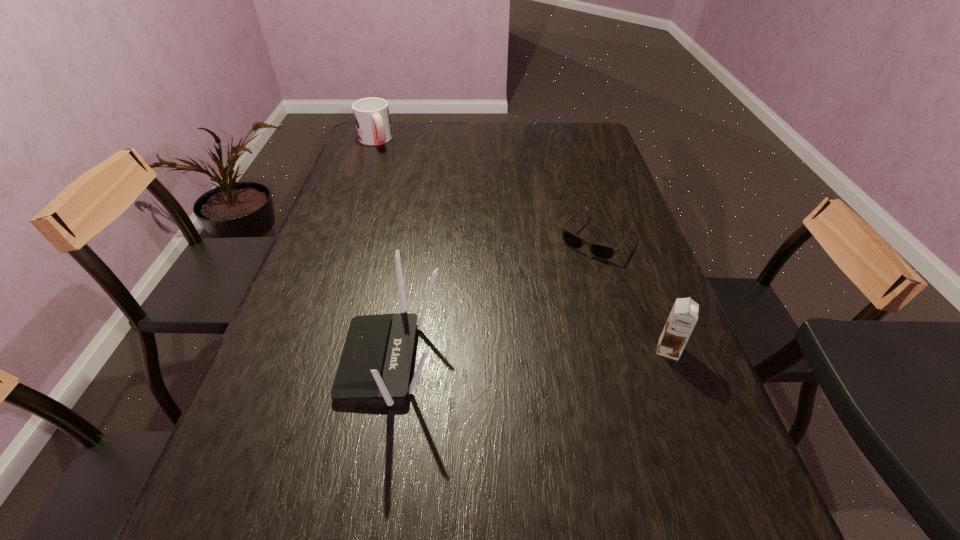
Where is `blank area in the image that satisfies the following two spatial constraints: 1. on the front side of the chocolate milk; 2. on the left side of the sunglasses`? The width and height of the screenshot is (960, 540). blank area in the image that satisfies the following two spatial constraints: 1. on the front side of the chocolate milk; 2. on the left side of the sunglasses is located at coordinates (630, 350).

Identify the location of free location that satisfies the following two spatial constraints: 1. on the front side of the sunglasses; 2. on the left side of the leftmost object. This screenshot has height=540, width=960. (339, 237).

Where is `free region that satisfies the following two spatial constraints: 1. on the front side of the router; 2. on the front-facing side of the farthest object`? Image resolution: width=960 pixels, height=540 pixels. free region that satisfies the following two spatial constraints: 1. on the front side of the router; 2. on the front-facing side of the farthest object is located at coordinates (295, 360).